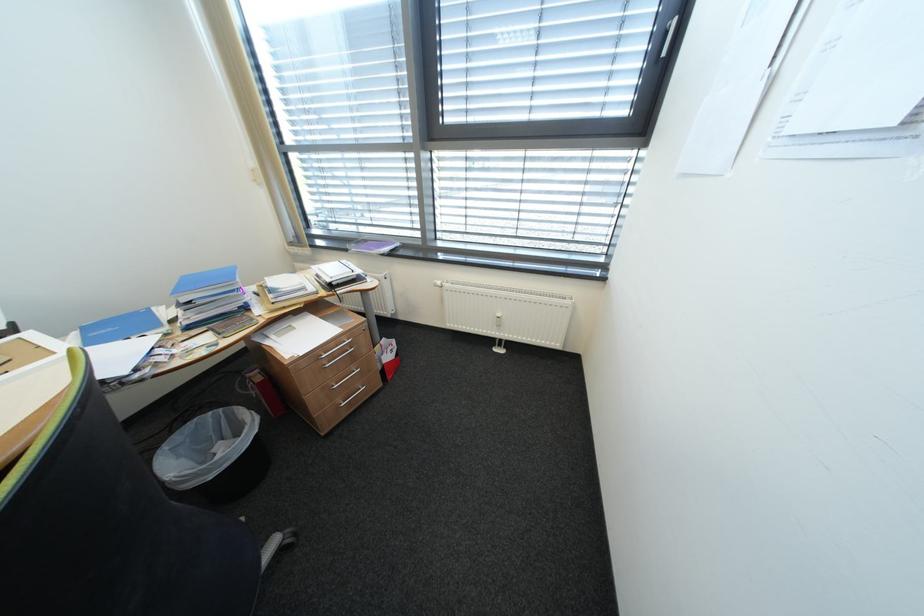
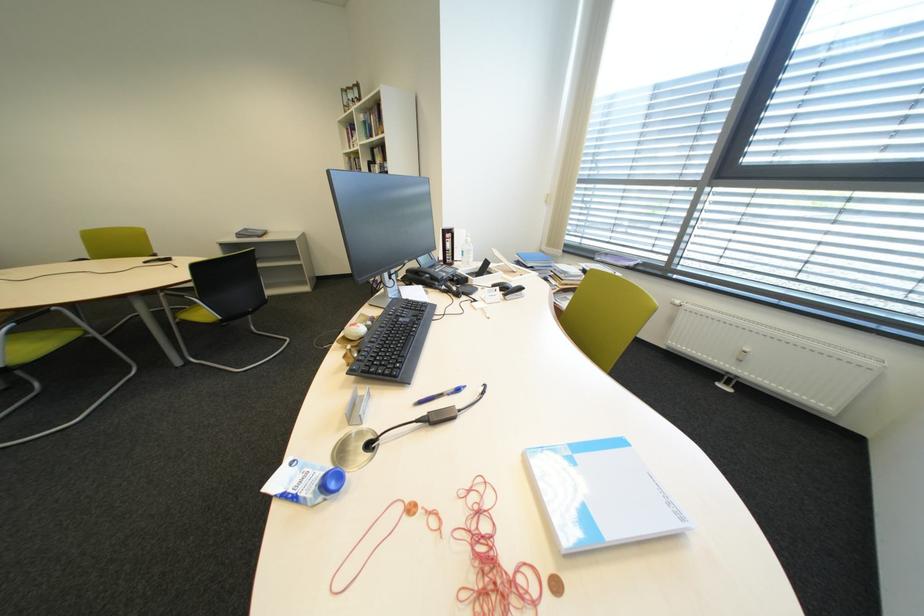
Question: The images are taken continuously from a first-person perspective. In which direction is your viewpoint rotating?

Choices:
 (A) Left
 (B) Right
 (C) Up
 (D) Down

Answer: (A)